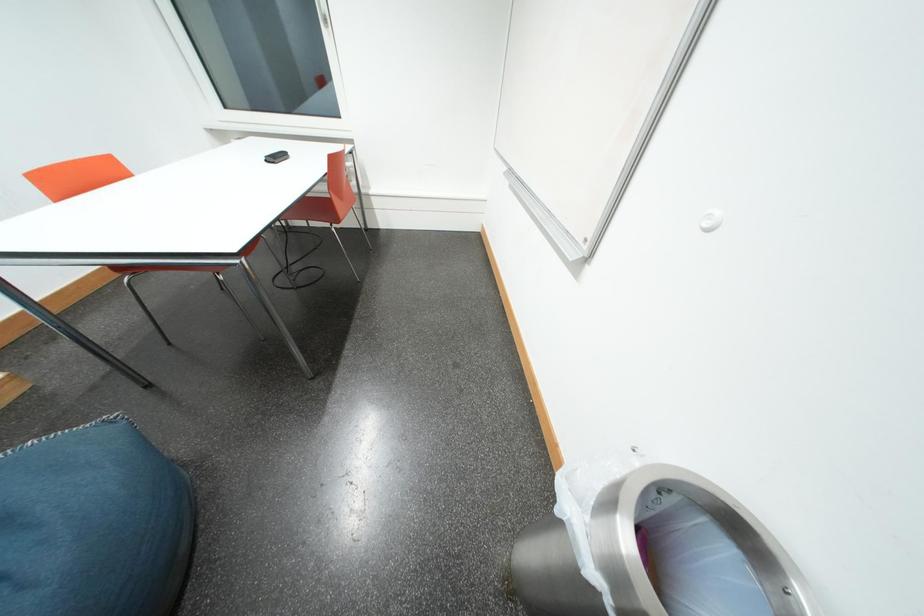
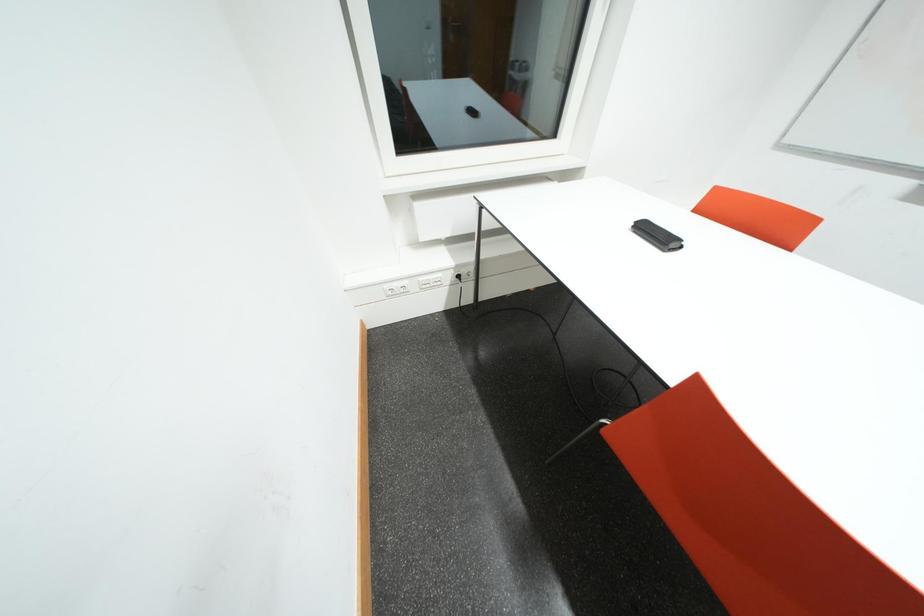
In a continuous first-person perspective shot, in which direction is the camera moving?

The cameraman moved toward left, forward.